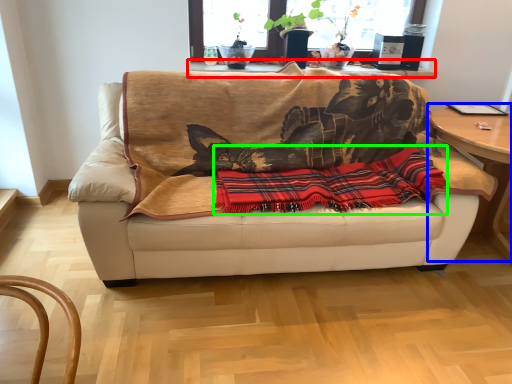
Question: Which is nearer to the table (highlighted by a red box)? table (highlighted by a blue box) or plaid (highlighted by a green box).

Choices:
 (A) table
 (B) plaid

Answer: (B)